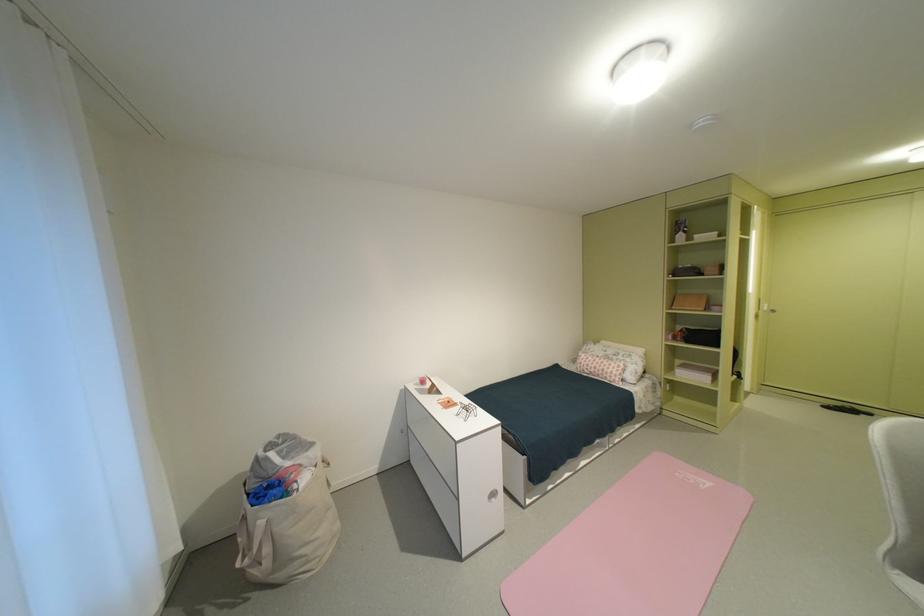
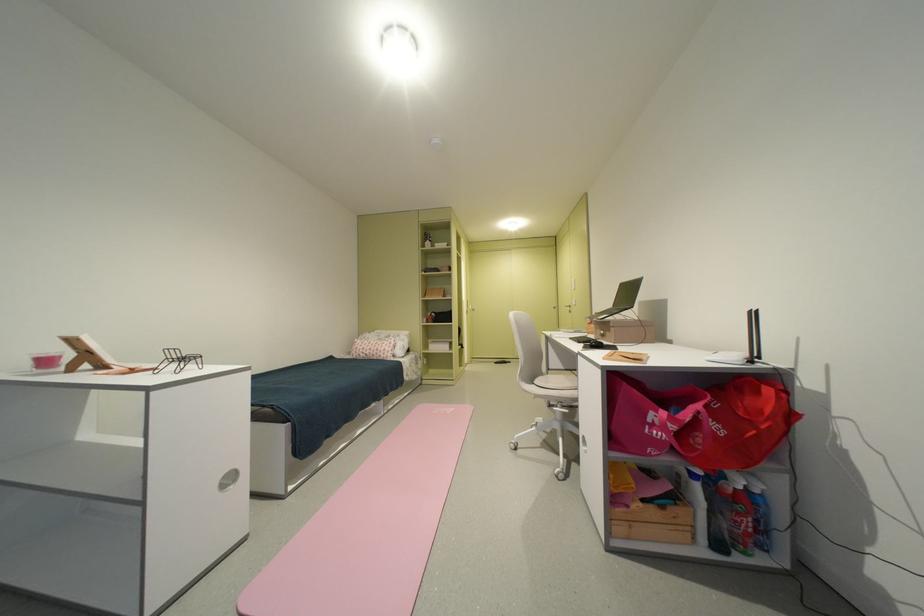
Question: The camera is either moving clockwise (left) or counter-clockwise (right) around the object. The first image is from the beginning of the video and the second image is from the end. Is the camera moving left or right when shooting the video?

Choices:
 (A) Left
 (B) Right

Answer: (A)